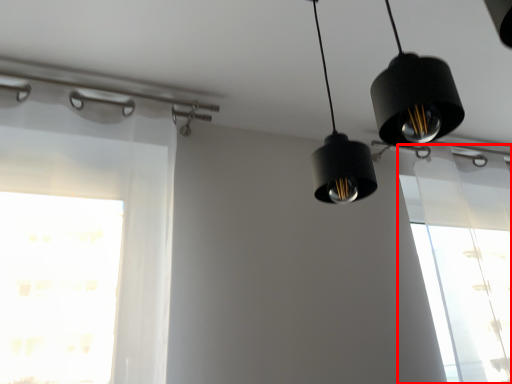
Question: From the image's perspective, where is window (annotated by the red box) located in relation to lighting in the image?

Choices:
 (A) above
 (B) below

Answer: (B)